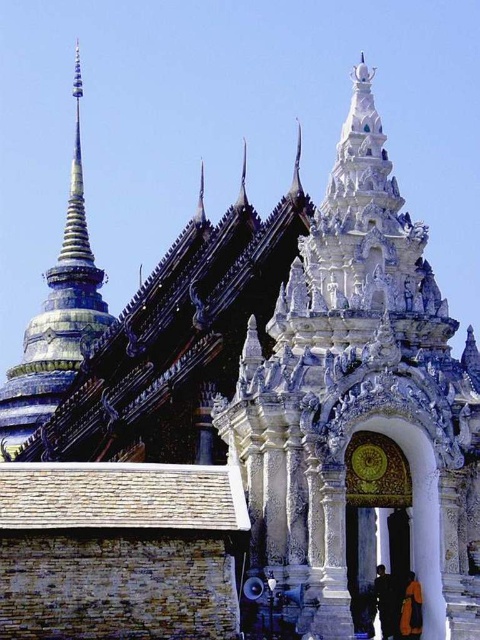
Question: Which object is farther from the camera taking this photo?

Choices:
 (A) blue lacquered spire at upper left
 (B) dark blue fabric at lower center
 (C) orange cloth at lower right

Answer: (A)

Question: Can you confirm if orange cloth at lower right is positioned above dark blue fabric at lower center?

Choices:
 (A) yes
 (B) no

Answer: (A)

Question: Can you confirm if orange cloth at lower right is positioned to the right of dark blue fabric at lower center?

Choices:
 (A) no
 (B) yes

Answer: (B)

Question: Which of the following is the closest to the observer?

Choices:
 (A) (384, 570)
 (B) (24, 424)

Answer: (A)

Question: Is blue lacquered spire at upper left wider than dark blue fabric at lower center?

Choices:
 (A) no
 (B) yes

Answer: (B)

Question: Which object is farther from the camera taking this photo?

Choices:
 (A) orange cloth at lower right
 (B) dark blue fabric at lower center

Answer: (B)